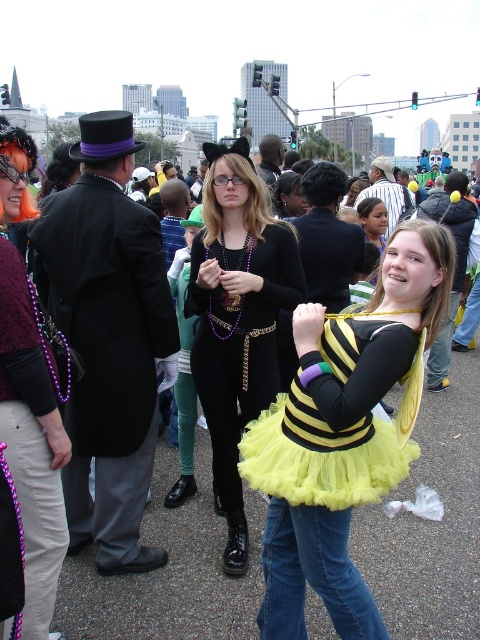
Can you confirm if black matte tutu at center is shorter than matte black dress at center?

Yes.

Does black matte tutu at center have a greater height compared to matte black dress at center?

In fact, black matte tutu at center may be shorter than matte black dress at center.

Which is behind, point (275, 340) or point (2, 252)?

The point (275, 340) is behind.

At what (x,y) coordinates should I click in order to perform the action: click on black matte tutu at center. Please return your answer as a coordinate pair (x, y). The width and height of the screenshot is (480, 640). Looking at the image, I should click on (238, 317).

Who is taller, yellow tulle skirt at center or matte black dress at center?

matte black dress at center

Is yellow tulle skirt at center above matte black dress at center?

No.

Image resolution: width=480 pixels, height=640 pixels. What do you see at coordinates (342, 435) in the screenshot?
I see `yellow tulle skirt at center` at bounding box center [342, 435].

Identify the location of yellow tulle skirt at center. (342, 435).

Is point (412, 456) more distant than point (27, 509)?

Yes, it is.

Find the location of a particular element. yellow tulle dress at center is located at coordinates (338, 420).